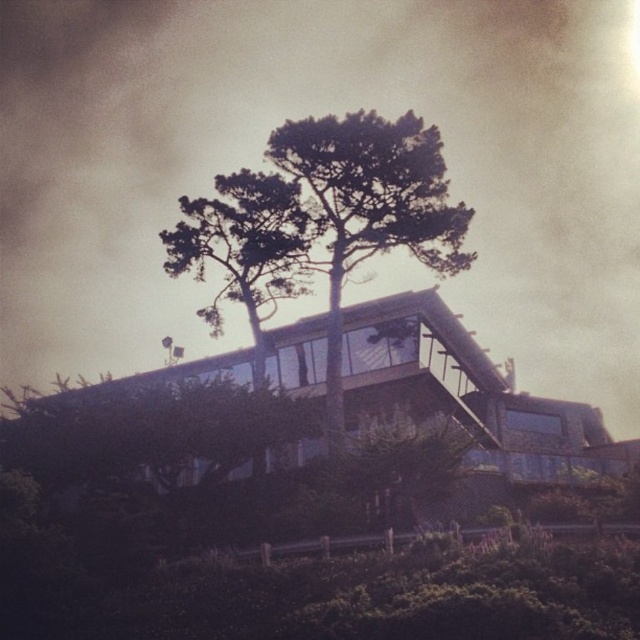
You are standing in front of the modern architectural structure and notice two points in the scene. The first point is at coordinates point (381, 186) and the second is at point (179, 252). Which of these points is closer to you?

Point (381, 186) is closer to the viewer than point (179, 252).

You are standing at the entrance of the modern architectural structure and want to walk towards the green leafy tree at center. Which direction should you head to reach it?

The green leafy tree at center is located at point 0.327 on the x and 0.578 on the y coordinate, so you should head towards the center of the image to reach it.